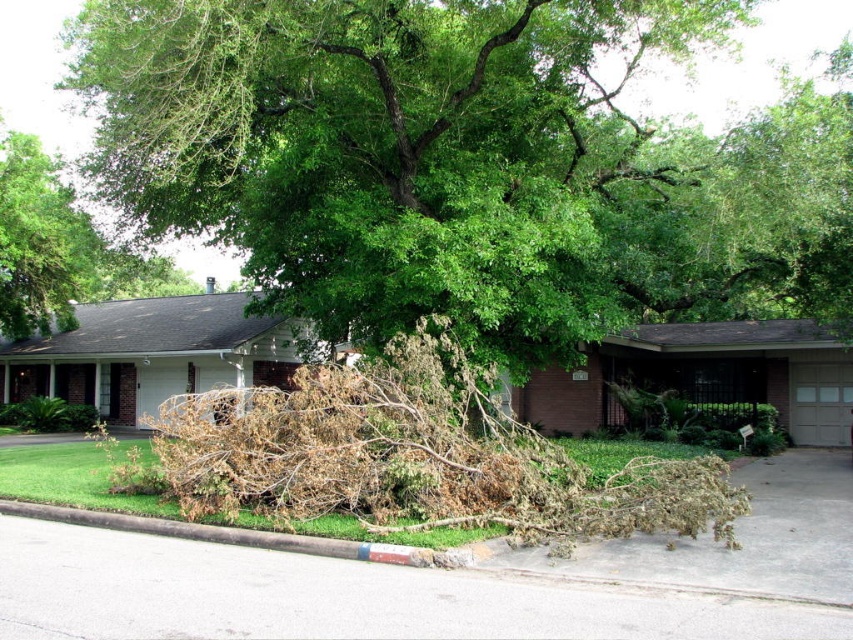
Does brown/dried wood at center appear under brown concrete curb at lower center?

No, brown/dried wood at center is not below brown concrete curb at lower center.

Between brown/dried wood at center and brown concrete curb at lower center, which one has more height?

With more height is brown/dried wood at center.

In order to click on brown/dried wood at center in this screenshot , I will do `click(463, 164)`.

Is brown dry branches at center to the left of brown concrete curb at lower center from the viewer's perspective?

Indeed, brown dry branches at center is positioned on the left side of brown concrete curb at lower center.

Does brown dry branches at center have a smaller size compared to brown concrete curb at lower center?

Incorrect, brown dry branches at center is not smaller in size than brown concrete curb at lower center.

Is point (347, 404) positioned behind point (709, 588)?

That is True.

Locate an element on the screen. The width and height of the screenshot is (853, 640). brown dry branches at center is located at coordinates (410, 458).

Can you confirm if brown dry branches at center is wider than green leafy tree at upper left?

No.

Does brown dry branches at center appear over green leafy tree at upper left?

Incorrect, brown dry branches at center is not positioned above green leafy tree at upper left.

Is point (235, 438) positioned before point (44, 236)?

Yes, point (235, 438) is closer to viewer.

This screenshot has width=853, height=640. What are the coordinates of `brown dry branches at center` in the screenshot? It's located at (410, 458).